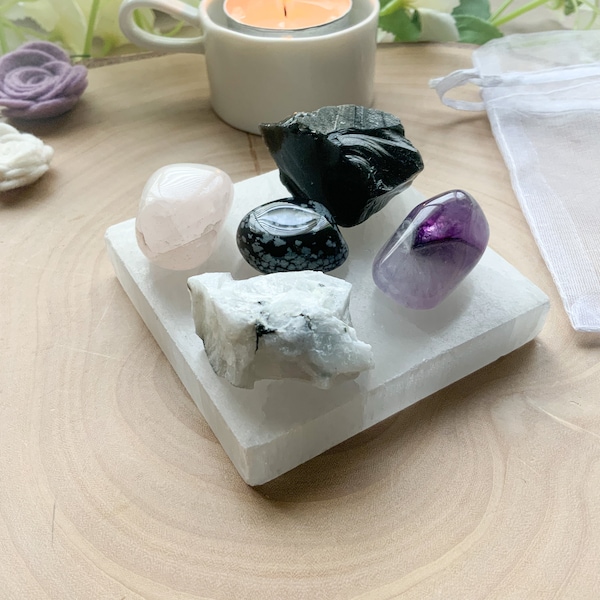
Locate an element on the screen. The image size is (600, 600). wood table is located at coordinates (x=68, y=445).